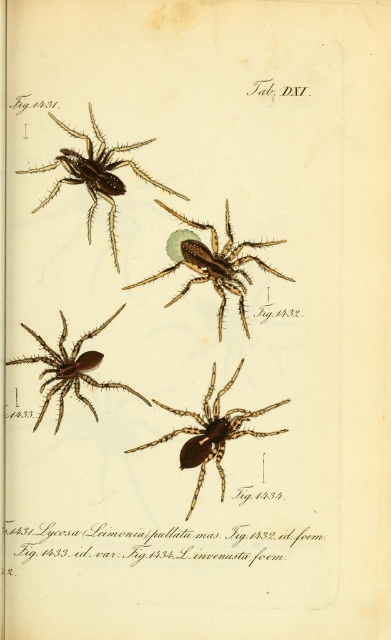
Question: Is brown textured spider at center smaller than shiny brown spider at center?

Choices:
 (A) yes
 (B) no

Answer: (A)

Question: Does brown textured spider at upper left have a greater width compared to shiny brown spider at center?

Choices:
 (A) yes
 (B) no

Answer: (A)

Question: Which object appears closest to the camera in this image?

Choices:
 (A) shiny brown spider at center
 (B) brown textured spider at upper left
 (C) brown textured spider at center

Answer: (B)

Question: Does brown textured spider at center have a smaller size compared to brown textured spider at upper left?

Choices:
 (A) no
 (B) yes

Answer: (B)

Question: Which point is closer to the camera taking this photo?

Choices:
 (A) (17, 358)
 (B) (109, 161)
 (C) (217, 444)
 (D) (181, 259)

Answer: (B)

Question: Which of the following is the farthest from the observer?

Choices:
 (A) brown matte spider at lower left
 (B) brown textured spider at upper left
 (C) brown textured spider at center

Answer: (C)